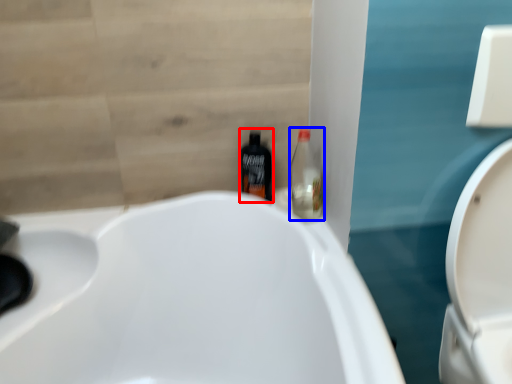
Question: Among these objects, which one is farthest to the camera, bottle (highlighted by a red box) or bottle (highlighted by a blue box)?

Choices:
 (A) bottle
 (B) bottle

Answer: (A)